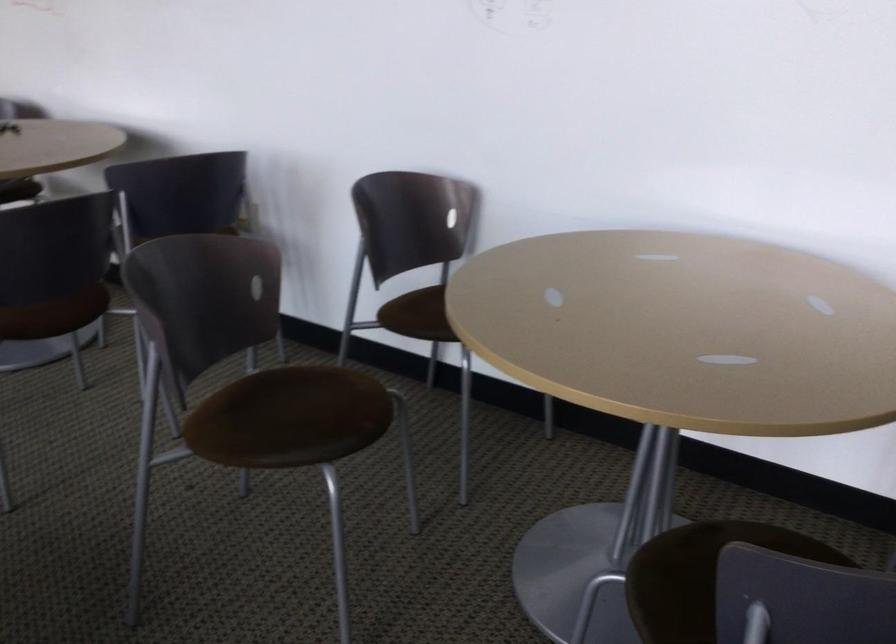
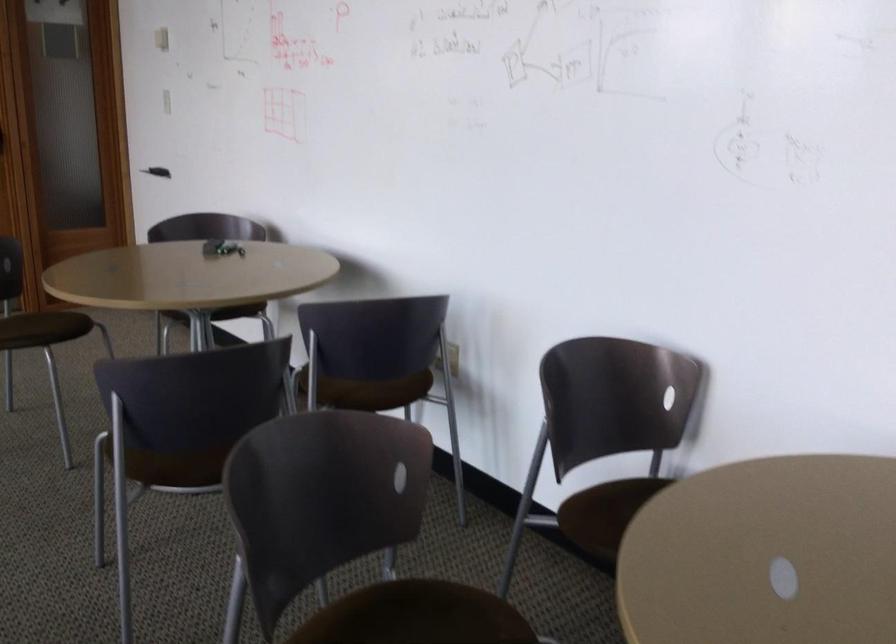
Find the pixel in the second image that matches [271,216] in the first image.

(452, 359)